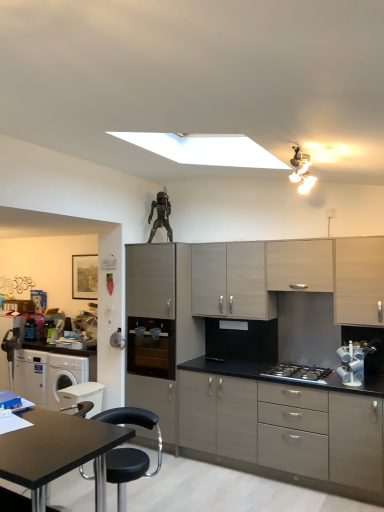
Question: From a real-world perspective, is stainless steel gas stove at center above or below black glass water dispenser at center?

Choices:
 (A) above
 (B) below

Answer: (B)

Question: Is stainless steel gas stove at center spatially inside black glass water dispenser at center, or outside of it?

Choices:
 (A) outside
 (B) inside

Answer: (A)

Question: Which of these objects is positioned farthest from the black matte table at lower left?

Choices:
 (A) stainless steel gas stove at center
 (B) black leather chair at lower left
 (C) light wood cabinet at center, the second cabinetry viewed from the left
 (D) light wood cabinet at upper center, the first cabinetry from the right
 (E) black glass water dispenser at center

Answer: (D)

Question: Based on their relative distances, which object is farther from the black matte table at lower left?

Choices:
 (A) black leather chair at lower left
 (B) light wood cabinet at center, arranged as the 3th cabinetry when viewed from the right
 (C) white plastic washing machine at lower left, which is counted as the second appliance, starting from the right
 (D) matte gray cabinet at center, the 4th cabinetry in the right-to-left sequence
 (E) white glossy cup at right, marked as the 1th appliance in a front-to-back arrangement

Answer: (E)